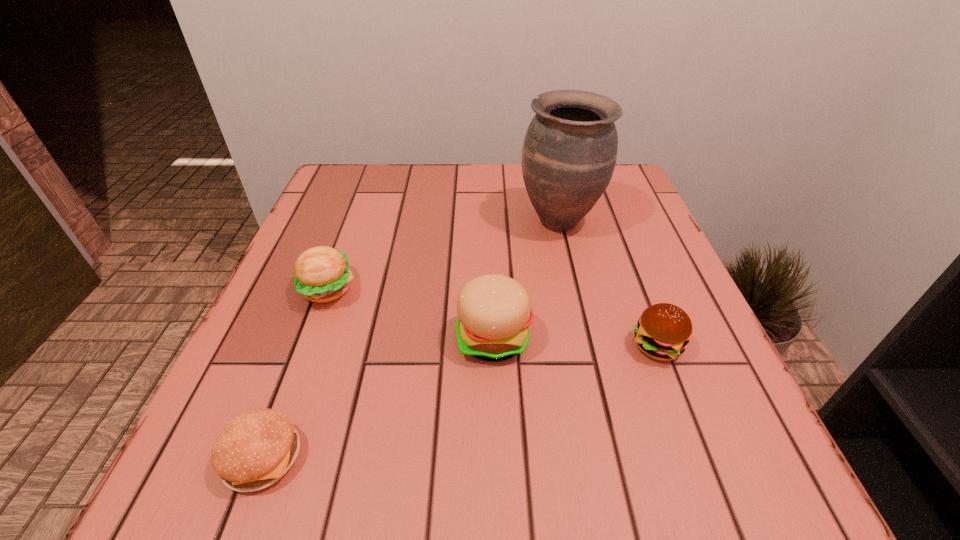
What are the coordinates of `vacant space at the right edge` in the screenshot? It's located at (635, 271).

In the image, there is a desktop. Where is `vacant space at the far left corner`? vacant space at the far left corner is located at coordinates 372,198.

Image resolution: width=960 pixels, height=540 pixels. In the image, there is a desktop. Identify the location of vacant area at the near left corner. click(293, 505).

Locate an element on the screen. Image resolution: width=960 pixels, height=540 pixels. vacant space at the near right corner is located at coordinates (699, 465).

Identify the location of free point between the tallest hamburger and the urn. The width and height of the screenshot is (960, 540). (526, 279).

Locate an element on the screen. The height and width of the screenshot is (540, 960). free spot between the urn and the rightmost hamburger is located at coordinates (608, 283).

You are a GUI agent. You are given a task and a screenshot of the screen. Output one action in this format:
    pyautogui.click(x=<x>, y=<y>)
    Task: Click on the vacant region between the third object from left to right and the rightmost hamburger
    This screenshot has height=540, width=960.
    Given the screenshot: What is the action you would take?
    pyautogui.click(x=575, y=342)

Locate an element on the screen. Image resolution: width=960 pixels, height=540 pixels. free space between the rightmost hamburger and the nearest object is located at coordinates (460, 401).

The height and width of the screenshot is (540, 960). In order to click on vacant area that lies between the second hamburger from right to left and the shortest object in this screenshot , I will do `click(378, 397)`.

Identify which object is located as the fourth nearest to the rightmost hamburger. Please provide its 2D coordinates. Your answer should be formatted as a tuple, i.e. [(x, y)], where the tuple contains the x and y coordinates of a point satisfying the conditions above.

[(254, 450)]